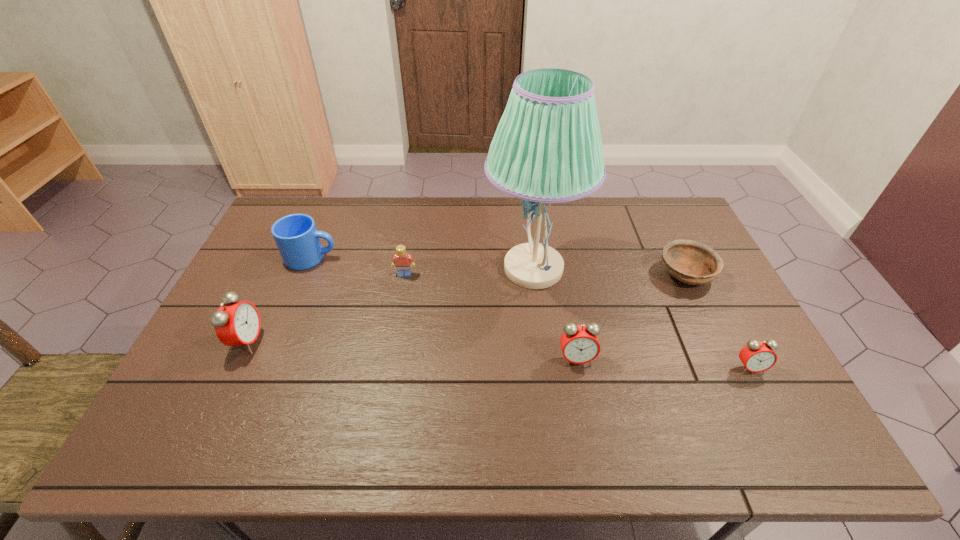
This screenshot has height=540, width=960. Identify the location of the tallest alarm clock. (237, 323).

Where is `the second alarm clock from left to right`? The width and height of the screenshot is (960, 540). the second alarm clock from left to right is located at coordinates (579, 344).

Locate an element on the screen. Image resolution: width=960 pixels, height=540 pixels. the shortest alarm clock is located at coordinates (757, 356).

The image size is (960, 540). I want to click on the second shortest object, so click(757, 356).

At what (x,y) coordinates should I click in order to perform the action: click on the shortest object. Please return your answer as a coordinate pair (x, y). Looking at the image, I should click on (691, 262).

Locate an element on the screen. mug is located at coordinates (296, 236).

This screenshot has width=960, height=540. Find the location of `the tallest object`. the tallest object is located at coordinates (547, 148).

Image resolution: width=960 pixels, height=540 pixels. Identify the location of the fifth object from right to left. [x=401, y=260].

The image size is (960, 540). Identify the location of free space located 0.170m on the front-facing side of the leftmost alarm clock. (324, 341).

This screenshot has width=960, height=540. I want to click on blank space located on the front-facing side of the second alarm clock from left to right, so click(583, 393).